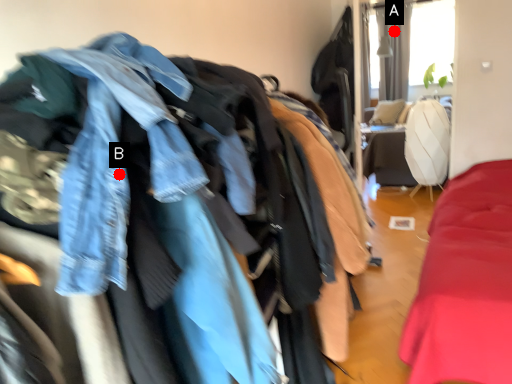
Question: Two points are circled on the image, labeled by A and B beside each circle. Which point is farther to the camera?

Choices:
 (A) A is further
 (B) B is further

Answer: (A)